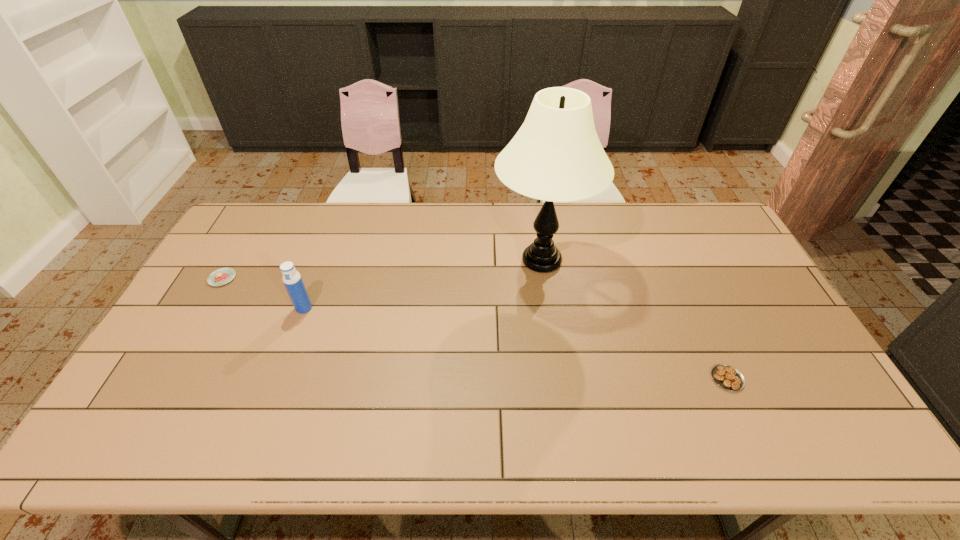
At what (x,y) coordinates should I click in order to perform the action: click on the closest object to the third shortest object. Please return your answer as a coordinate pair (x, y). Looking at the image, I should click on (222, 276).

Identify the location of blank space that satisfies the following two spatial constraints: 1. on the front side of the farther pastry; 2. on the left side of the water bottle. Image resolution: width=960 pixels, height=540 pixels. (205, 308).

What are the coordinates of `vacant space that satisfies the following two spatial constraints: 1. on the front side of the nearest object; 2. on the left side of the leftmost object` in the screenshot? It's located at (164, 379).

Find the location of a particular element. free space that satisfies the following two spatial constraints: 1. on the front side of the left pastry; 2. on the left side of the rightmost object is located at coordinates (164, 379).

Locate an element on the screen. This screenshot has height=540, width=960. blank space that satisfies the following two spatial constraints: 1. on the back side of the second tallest object; 2. on the left side of the tallest object is located at coordinates (322, 260).